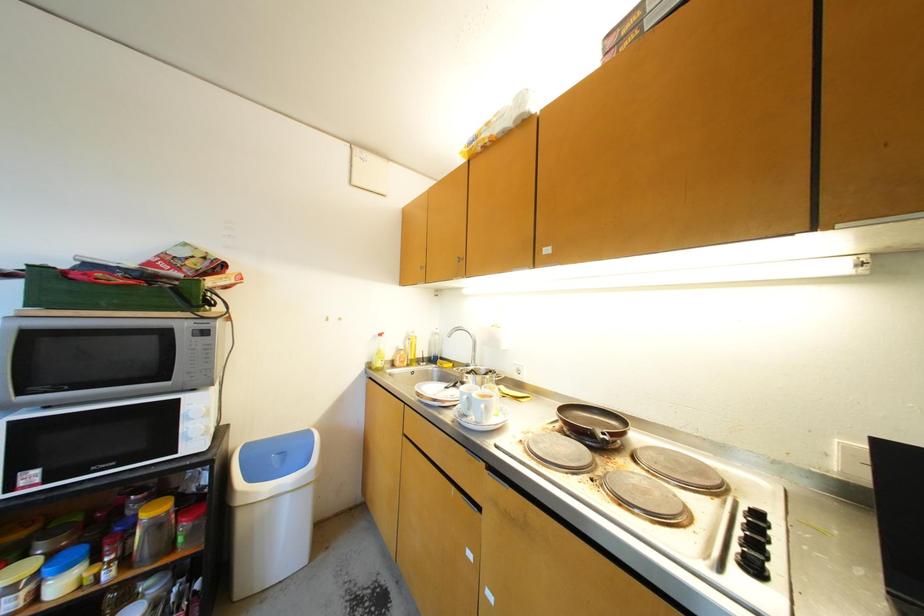
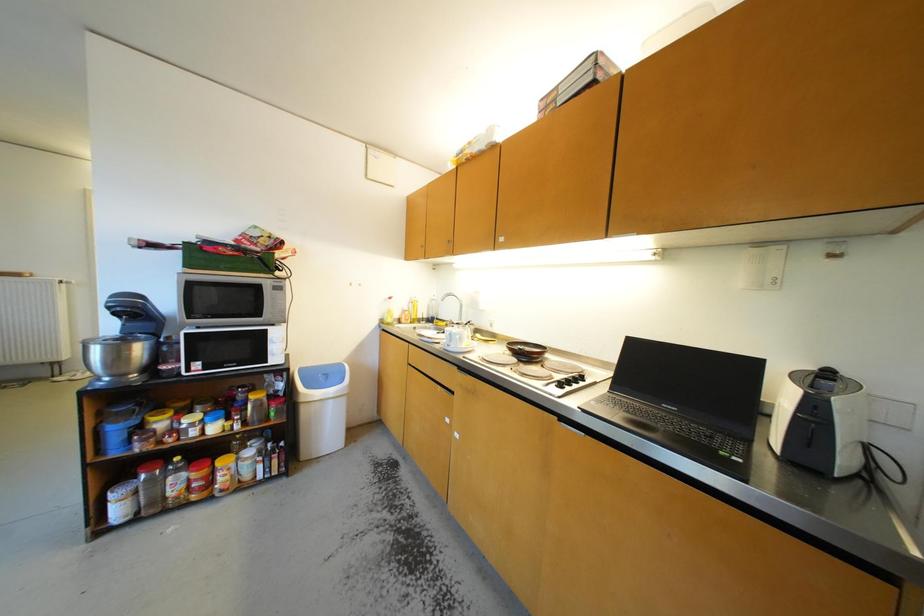
Question: The images are taken continuously from a first-person perspective. In which direction is your viewpoint rotating?

Choices:
 (A) Left
 (B) Right
 (C) Up
 (D) Down

Answer: (D)